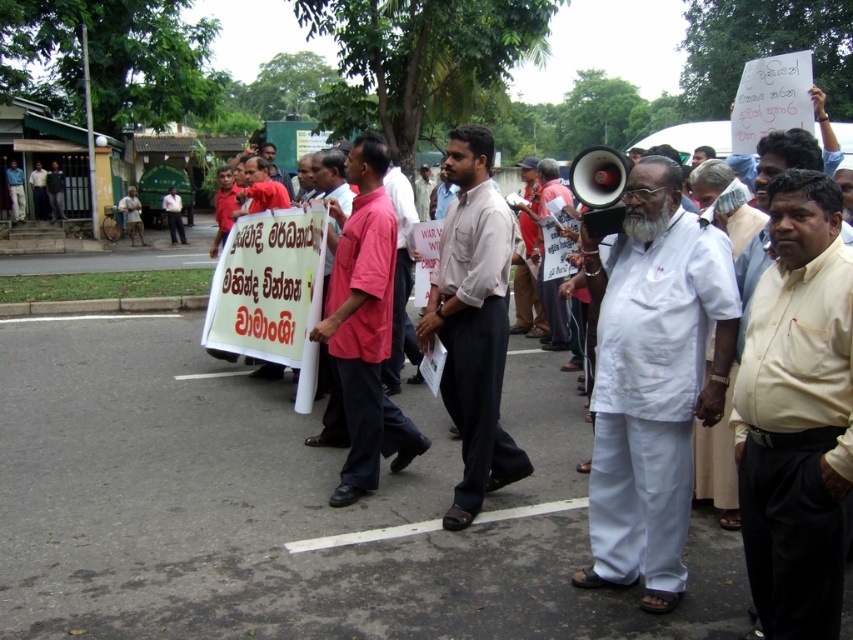
You are standing at the center of the protest area and want to move towards the two points marked in the image. Which point, point (497, 333) or point (265, 157), is closer to you?

Point (497, 333) is closer to the viewer than point (265, 157), so you should move towards point (497, 333) first.

You are a photographer at the protest scene. You want to take a photo that includes both the light beige shirt at center and the red shirt at center. Based on their positions, which shirt should you focus on first to ensure both are in the frame?

The light beige shirt at center is positioned on the right side of red shirt at center. To include both in the frame, focus on the red shirt at center first as it is on the left, then adjust to include the light beige shirt at center on the right.